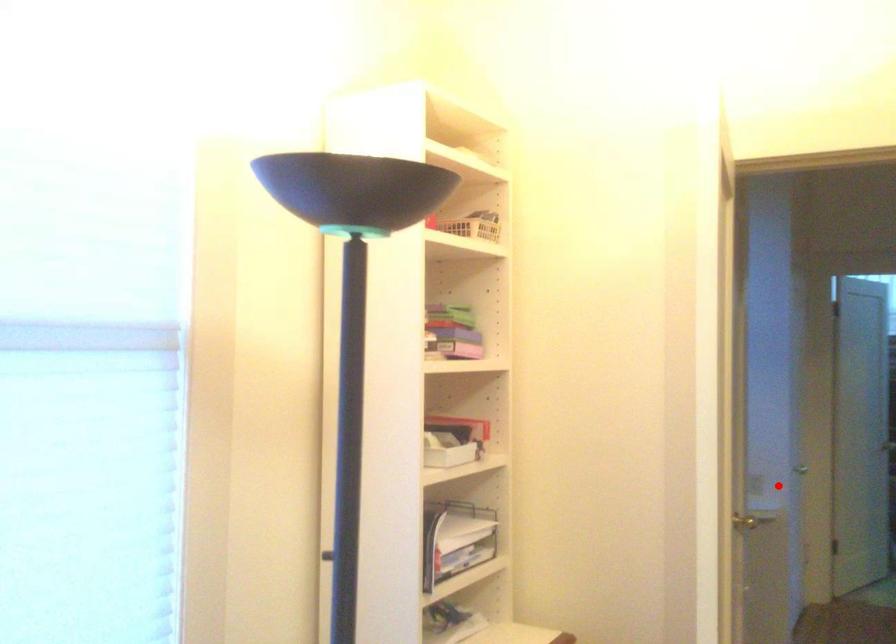
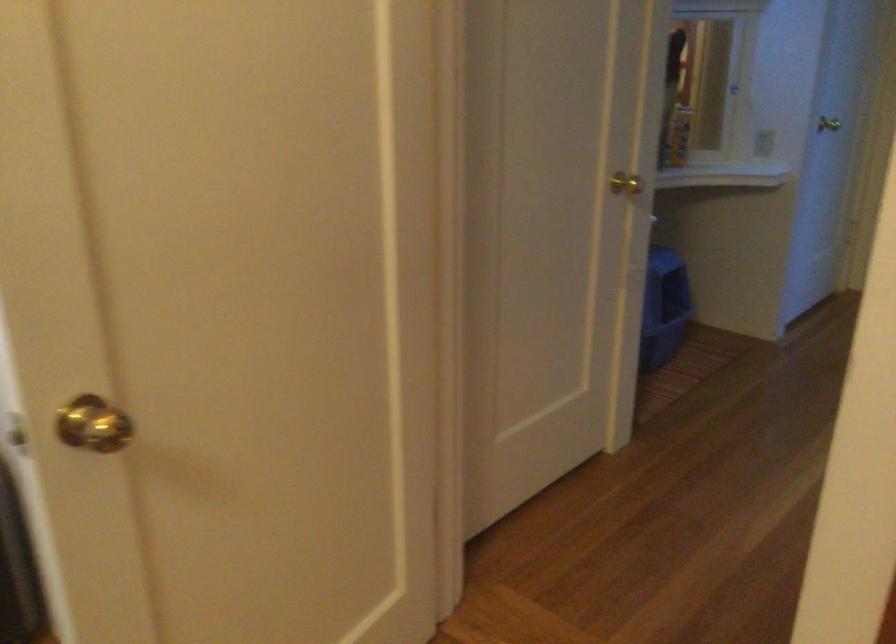
Question: I am providing you with two images of the same scene from different viewpoints. A red point is shown in image1. For the corresponding object point in image2, is it positioned nearer or farther from the camera?

Choices:
 (A) Nearer
 (B) Farther

Answer: (A)